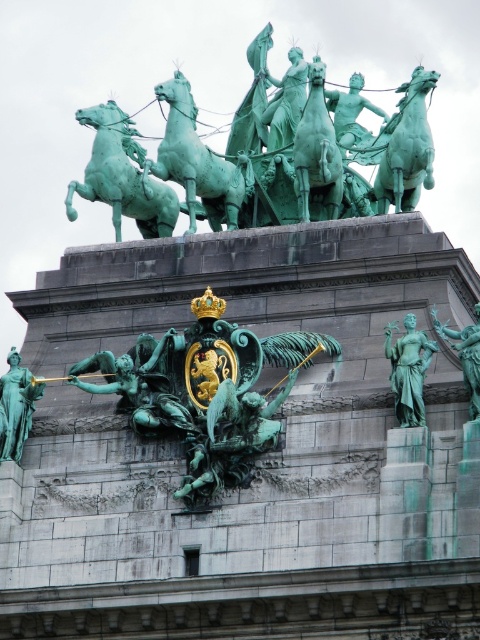
Can you confirm if green patina horse at upper center is wider than green patinated bronze figure at center?

Indeed, green patina horse at upper center has a greater width compared to green patinated bronze figure at center.

Is green patina horse at upper center positioned at the back of green patinated bronze figure at center?

Yes, it is behind green patinated bronze figure at center.

Is point (122, 200) closer to camera compared to point (153, 381)?

No, it is not.

Find the location of a particular element. The image size is (480, 640). green patina horse at upper center is located at coordinates (121, 176).

Who is lower down, green patinated metal horse at center or green patinated statue at center-right?

green patinated statue at center-right is lower down.

Is green patinated metal horse at center further to the viewer compared to green patinated statue at center-right?

Yes, it is.

Is point (326, 202) closer to camera compared to point (393, 324)?

No, (326, 202) is further to viewer.

Image resolution: width=480 pixels, height=640 pixels. I want to click on green patinated metal horse at center, so click(316, 150).

Who is taller, green patina chariot at upper center or green patinated bronze figure at center?

green patina chariot at upper center

Measure the distance between green patina chariot at upper center and camera.

green patina chariot at upper center and camera are 88.66 meters apart.

Locate an element on the screen. green patina chariot at upper center is located at coordinates (269, 156).